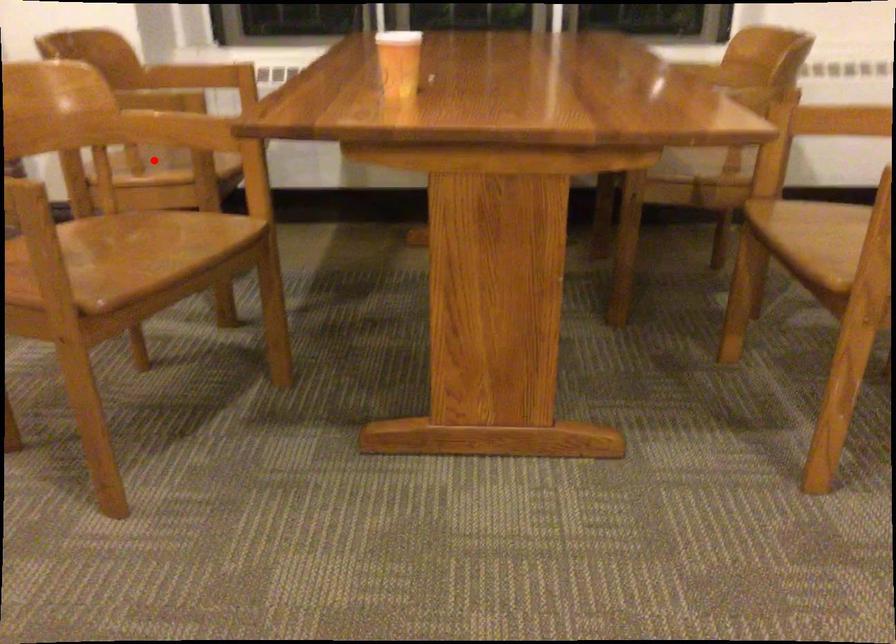
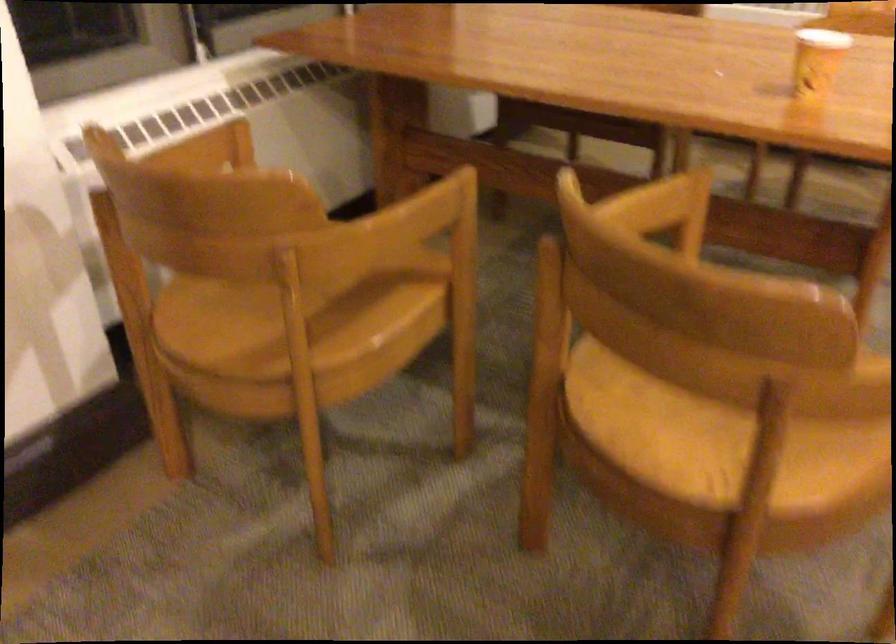
Question: I am providing you with two images of the same scene from different viewpoints. In image1, a red point is highlighted. Considering the same 3D point in image2, which of the following is correct?

Choices:
 (A) It is closer
 (B) It is farther

Answer: (A)